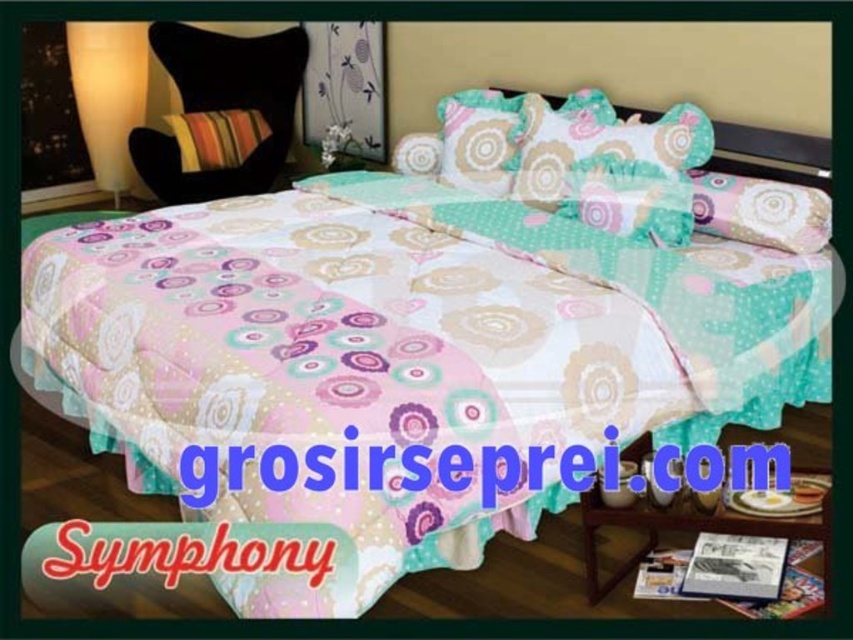
You are standing at the center of the bedroom and want to place a new decorative item exactly at the coordinates where the pink fabric pillow at upper right is located. What are the coordinates you should aim for?

The coordinates for the pink fabric pillow at upper right are at point (759, 211).

You are standing in the bedroom and want to place a new picture frame between the white frosted glass lamp at upper left and the pink fabric pillow at upper right. Based on their positions, where should you place the frame?

The white frosted glass lamp at upper left is located above the pink fabric pillow at upper right, so you should place the picture frame between them horizontally, positioning it below the lamp and above the pillow.

You are arranging flowers in the bedroom and need to place a vase between the white frosted glass lamp at upper left and the striped fabric pillow at upper left. Can you fit the vase between them vertically?

The white frosted glass lamp at upper left is above the striped fabric pillow at upper left, so there is vertical space between them. The vase can be placed between them vertically.